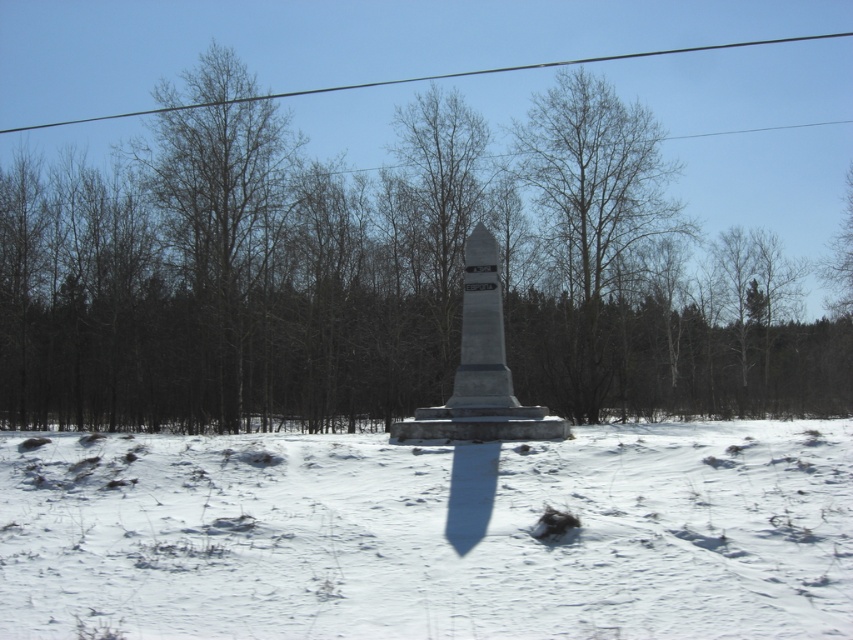
Question: Considering the real-world distances, which object is closest to the bare wood tree at center?

Choices:
 (A) black wire at upper center
 (B) brown wood tree at center

Answer: (B)

Question: Is brown wood tree at center behind gray stone monument at center?

Choices:
 (A) yes
 (B) no

Answer: (A)

Question: Can you confirm if brown wood tree at center is wider than bare wood tree at left?

Choices:
 (A) no
 (B) yes

Answer: (B)

Question: Which object is positioned farthest from the white powdery snow at center?

Choices:
 (A) gray stone monument at center
 (B) bare wood tree at center

Answer: (B)

Question: Is bare wood tree at center positioned behind black wire at upper center?

Choices:
 (A) no
 (B) yes

Answer: (A)

Question: Which object is closer to the camera taking this photo?

Choices:
 (A) gray stone monument at center
 (B) white powdery snow at center
 (C) brown wood tree at center

Answer: (B)